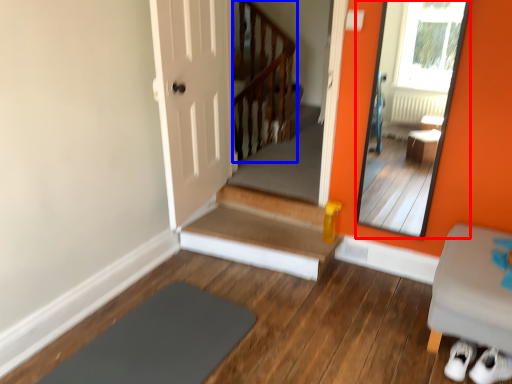
Question: Which of the following is the closest to the observer, mirror (highlighted by a red box) or balustrade (highlighted by a blue box)?

Choices:
 (A) mirror
 (B) balustrade

Answer: (A)